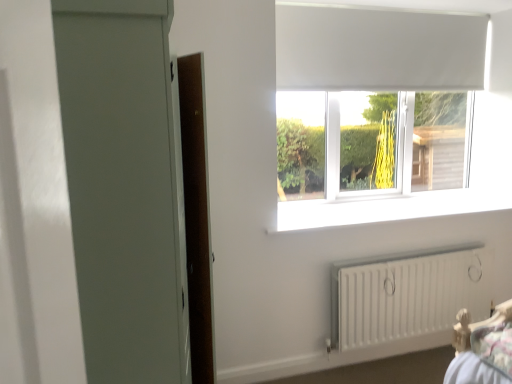
Question: In the image, is matte gray screen door at left positioned in front of or behind white matte curtain at upper center?

Choices:
 (A) front
 (B) behind

Answer: (A)

Question: Is matte gray screen door at left situated inside white matte curtain at upper center or outside?

Choices:
 (A) inside
 (B) outside

Answer: (B)

Question: Which of these objects is positioned farthest from the white matte window at upper center?

Choices:
 (A) white smooth window sill at center
 (B) matte gray screen door at left
 (C) white matte curtain at upper center
 (D) white matte radiator at lower right

Answer: (B)

Question: Estimate the real-world distances between objects in this image. Which object is closer to the matte gray screen door at left?

Choices:
 (A) white matte curtain at upper center
 (B) white smooth window sill at center
 (C) white matte window at upper center
 (D) white matte radiator at lower right

Answer: (B)